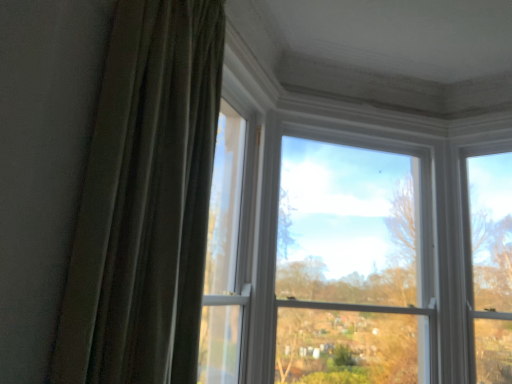
Question: Is green velvet curtain at left inside or outside of clear glass window at center?

Choices:
 (A) outside
 (B) inside

Answer: (A)

Question: Considering the positions of green velvet curtain at left and clear glass window at center in the image, is green velvet curtain at left bigger or smaller than clear glass window at center?

Choices:
 (A) big
 (B) small

Answer: (B)

Question: Looking at their shapes, would you say green velvet curtain at left is wider or thinner than clear glass window at center?

Choices:
 (A) wide
 (B) thin

Answer: (A)

Question: Would you say clear glass window at center is inside or outside green velvet curtain at left?

Choices:
 (A) inside
 (B) outside

Answer: (B)

Question: From a real-world perspective, is clear glass window at center physically located above or below green velvet curtain at left?

Choices:
 (A) below
 (B) above

Answer: (A)

Question: Visually, is clear glass window at center positioned to the left or to the right of green velvet curtain at left?

Choices:
 (A) right
 (B) left

Answer: (A)

Question: Is clear glass window at center in front of or behind green velvet curtain at left in the image?

Choices:
 (A) behind
 (B) front

Answer: (A)